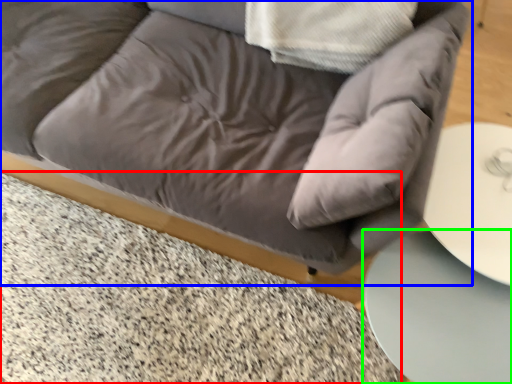
Question: Which object is positioned closest to marble (highlighted by a red box)? Select from studio couch (highlighted by a blue box) and table (highlighted by a green box).

Choices:
 (A) studio couch
 (B) table

Answer: (A)